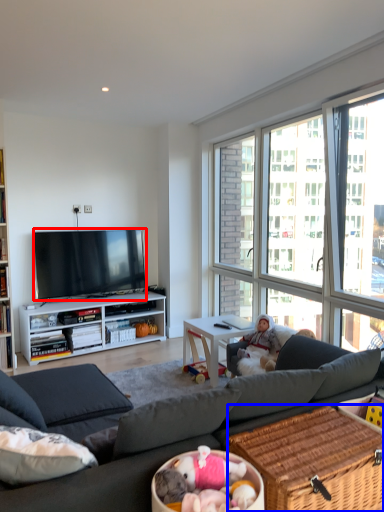
Question: Which of the following is the closest to the observer, television (highlighted by a red box) or picnic basket (highlighted by a blue box)?

Choices:
 (A) television
 (B) picnic basket

Answer: (B)